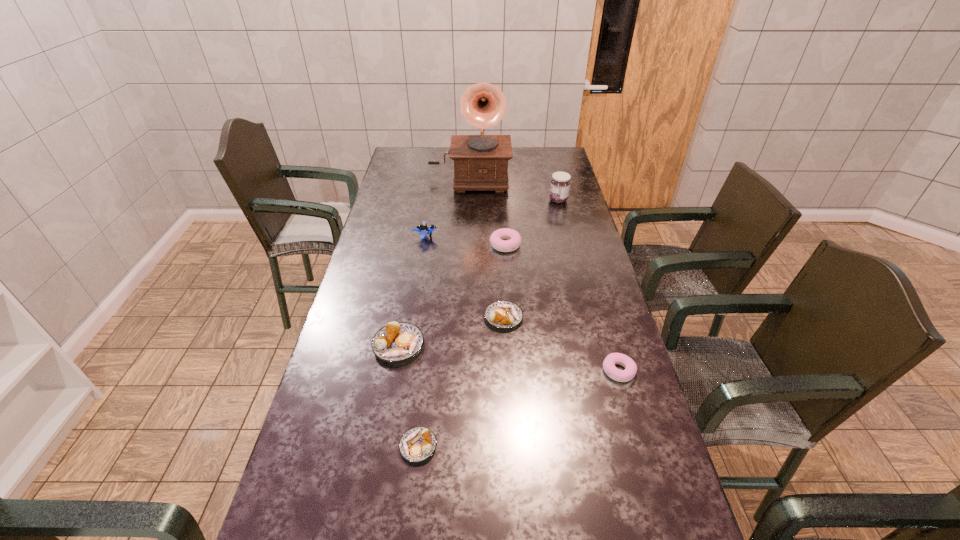
Where is `the right pink pastry`? the right pink pastry is located at coordinates 611,360.

Where is `the rightmost pastry`? the rightmost pastry is located at coordinates (611, 360).

This screenshot has height=540, width=960. Find the location of `the nearest brown pastry`. the nearest brown pastry is located at coordinates (417, 444).

Where is `the nearest pastry`? This screenshot has height=540, width=960. the nearest pastry is located at coordinates (417, 444).

What are the coordinates of `vacant area located 0.100m on the horn of the farthest object` in the screenshot? It's located at (468, 207).

Image resolution: width=960 pixels, height=540 pixels. Identify the location of free spot located 0.130m on the front label of the second farthest object. (518, 200).

Image resolution: width=960 pixels, height=540 pixels. Identify the location of blank area located on the front label of the second farthest object. (523, 200).

You are a GUI agent. You are given a task and a screenshot of the screen. Output one action in this format:
    pyautogui.click(x=<x>, y=<y>)
    Task: Click on the vacant space situated on the front label of the second farthest object
    This screenshot has height=540, width=960.
    Given the screenshot: What is the action you would take?
    pyautogui.click(x=486, y=200)

I want to click on free space located on the front-facing side of the sixth shortest object, so click(x=540, y=237).

Where is `vacant space located 0.230m on the back of the biggest brown pastry`? The image size is (960, 540). vacant space located 0.230m on the back of the biggest brown pastry is located at coordinates (411, 276).